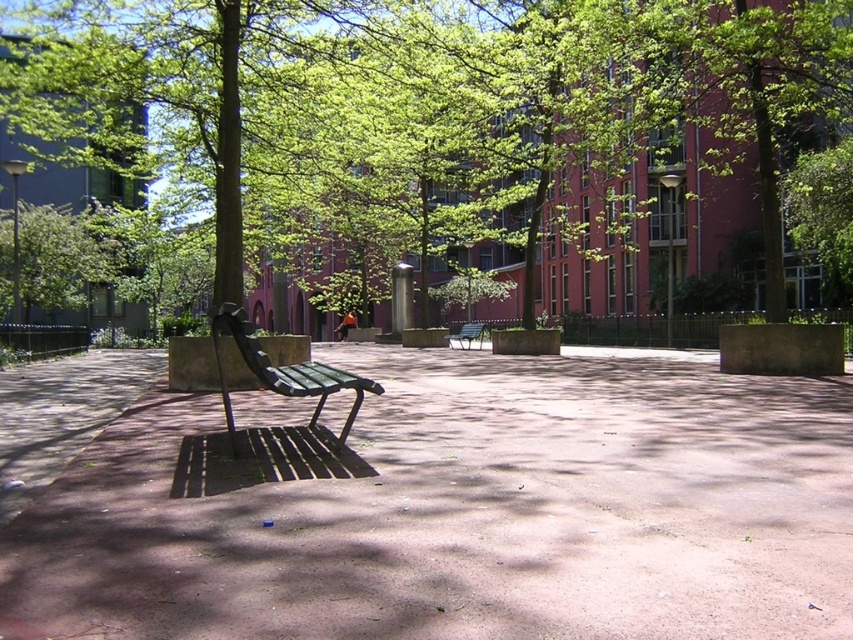
Who is higher up, brown concrete pavement at center or green painted wood bench at center?

green painted wood bench at center is above.

Locate an element on the screen. brown concrete pavement at center is located at coordinates (463, 513).

Locate an element on the screen. The height and width of the screenshot is (640, 853). brown concrete pavement at center is located at coordinates (463, 513).

Between point (288, 420) and point (471, 337), which one is positioned behind?

The point (471, 337) is behind.

Is brown concrete pavement at center taller than wooden bench at center?

No.

Image resolution: width=853 pixels, height=640 pixels. In order to click on brown concrete pavement at center in this screenshot , I will do `click(463, 513)`.

Find the location of a particular element. brown concrete pavement at center is located at coordinates click(x=463, y=513).

From the picture: Can you confirm if green leafy tree at center is positioned to the right of wooden bench at center?

In fact, green leafy tree at center is to the left of wooden bench at center.

At what (x,y) coordinates should I click in order to perform the action: click on green leafy tree at center. Please return your answer as a coordinate pair (x, y). Looking at the image, I should click on (519, 115).

Describe the element at coordinates (519, 115) in the screenshot. I see `green leafy tree at center` at that location.

Find the location of `green leafy tree at center`. green leafy tree at center is located at coordinates 519,115.